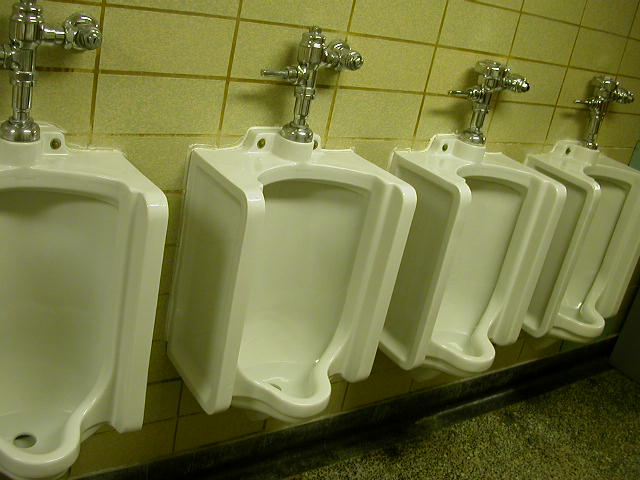
The image size is (640, 480). Identify the location of urinals. (42, 307), (281, 278), (483, 247), (595, 243).